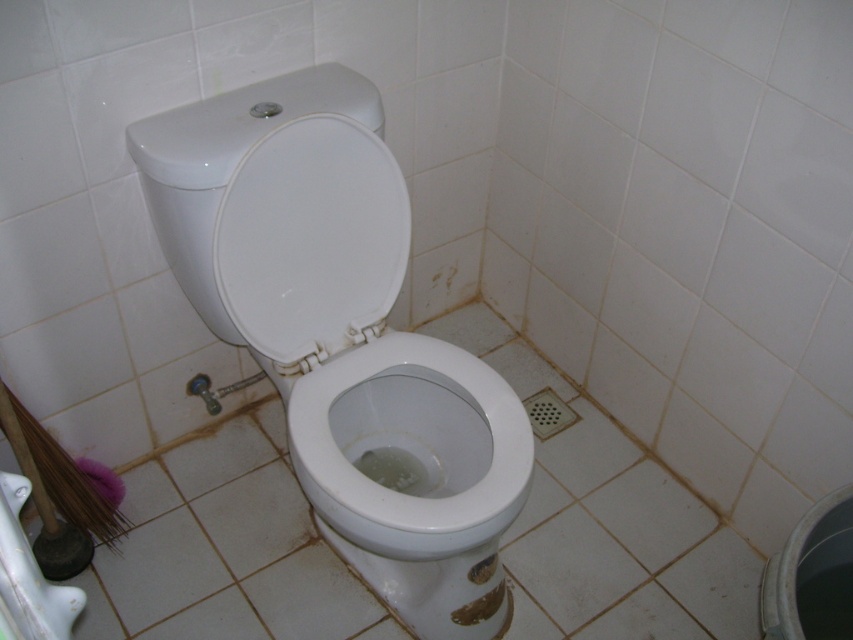
Question: Which point is farther to the camera?

Choices:
 (A) white glossy toilet at center
 (B) white glossy toilet bowl at center
 (C) white glossy toilet lid at center

Answer: (C)

Question: Where is white glossy toilet at center located in relation to white glossy toilet lid at center in the image?

Choices:
 (A) left
 (B) right

Answer: (B)

Question: Can you confirm if white glossy toilet at center is smaller than white glossy toilet lid at center?

Choices:
 (A) yes
 (B) no

Answer: (B)

Question: Among these objects, which one is nearest to the camera?

Choices:
 (A) white glossy toilet at center
 (B) white glossy toilet bowl at center

Answer: (B)

Question: Is white glossy toilet at center bigger than white glossy toilet bowl at center?

Choices:
 (A) no
 (B) yes

Answer: (B)

Question: Which of the following is the closest to the observer?

Choices:
 (A) white glossy toilet lid at center
 (B) white glossy toilet at center

Answer: (B)